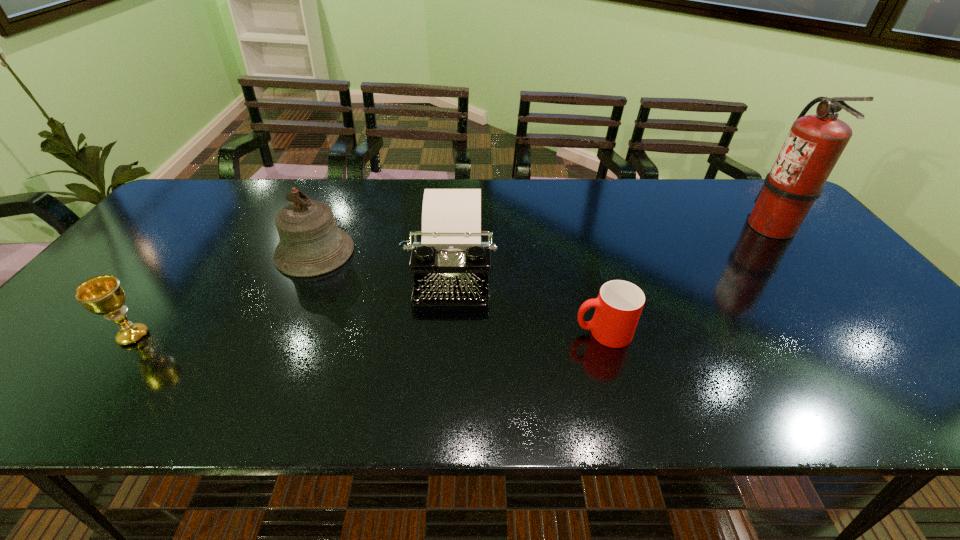
At what (x,y) coordinates should I click in order to perform the action: click on object at the far right corner. Please return your answer as a coordinate pair (x, y). The width and height of the screenshot is (960, 540). Looking at the image, I should click on (x=814, y=144).

Find the location of a particular element. The image size is (960, 540). vacant space at the far edge of the desktop is located at coordinates (276, 183).

Where is `vacant space at the near edge of the desktop`? The height and width of the screenshot is (540, 960). vacant space at the near edge of the desktop is located at coordinates (507, 401).

Find the location of a particular element. The width and height of the screenshot is (960, 540). vacant space at the left edge is located at coordinates point(100,359).

Locate an element on the screen. The width and height of the screenshot is (960, 540). vacant space at the right edge of the desktop is located at coordinates (902, 366).

Where is `empty location between the leftmost object and the typewriter`? The image size is (960, 540). empty location between the leftmost object and the typewriter is located at coordinates (292, 303).

Where is `unoccupied area between the cup and the typewriter`? The image size is (960, 540). unoccupied area between the cup and the typewriter is located at coordinates (527, 301).

Locate an element on the screen. The width and height of the screenshot is (960, 540). free space between the leftmost object and the third object from right to left is located at coordinates (292, 303).

I want to click on free space between the typewriter and the chalice, so click(x=292, y=303).

Where is `vacant area that lies between the cup and the rightmost object`? The height and width of the screenshot is (540, 960). vacant area that lies between the cup and the rightmost object is located at coordinates (686, 279).